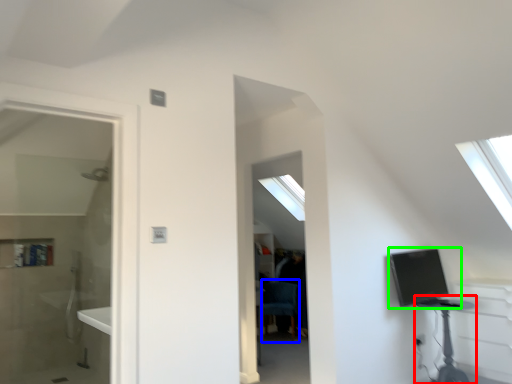
Question: Estimate the real-world distances between objects in this image. Which object is farther from table (highlighted by a red box), swivel chair (highlighted by a blue box) or computer (highlighted by a green box)?

Choices:
 (A) swivel chair
 (B) computer

Answer: (A)